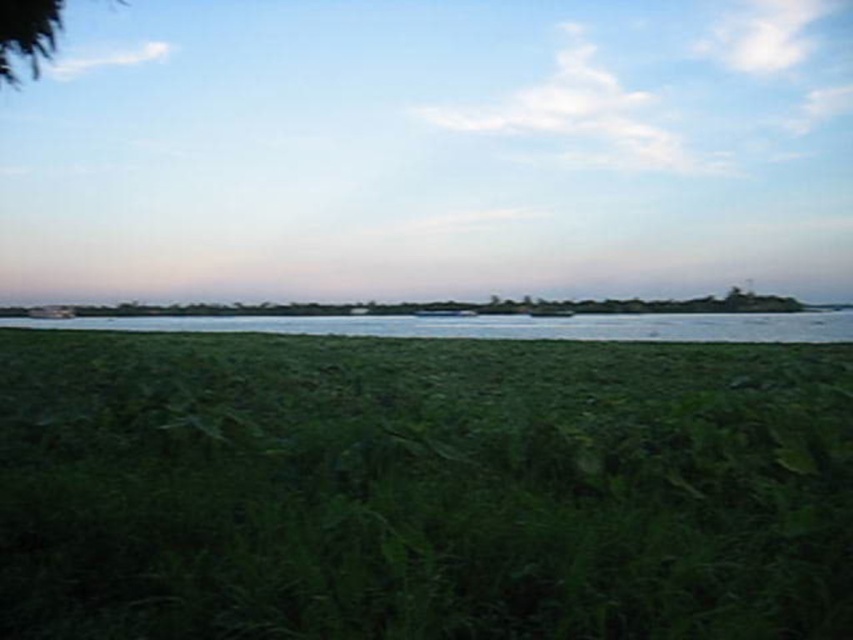
Does green matte grass at center have a greater height compared to green leafy tree at upper left?

Incorrect, green matte grass at center's height is not larger of green leafy tree at upper left's.

Does point (422, 436) come in front of point (56, 13)?

Yes, point (422, 436) is in front of point (56, 13).

At what (x,y) coordinates should I click in order to perform the action: click on green matte grass at center. Please return your answer as a coordinate pair (x, y). The height and width of the screenshot is (640, 853). Looking at the image, I should click on (421, 488).

Does point (740, 627) come closer to viewer compared to point (672, 336)?

Yes, it is.

Find the location of a particular element. The width and height of the screenshot is (853, 640). green matte grass at center is located at coordinates (421, 488).

Where is `green matte grass at center`? This screenshot has height=640, width=853. green matte grass at center is located at coordinates (421, 488).

Can you confirm if clear water at center is taller than green leafy tree at upper left?

No, clear water at center is not taller than green leafy tree at upper left.

Which of these two, clear water at center or green leafy tree at upper left, stands taller?

green leafy tree at upper left is taller.

Find the location of a particular element. This screenshot has height=640, width=853. clear water at center is located at coordinates (498, 324).